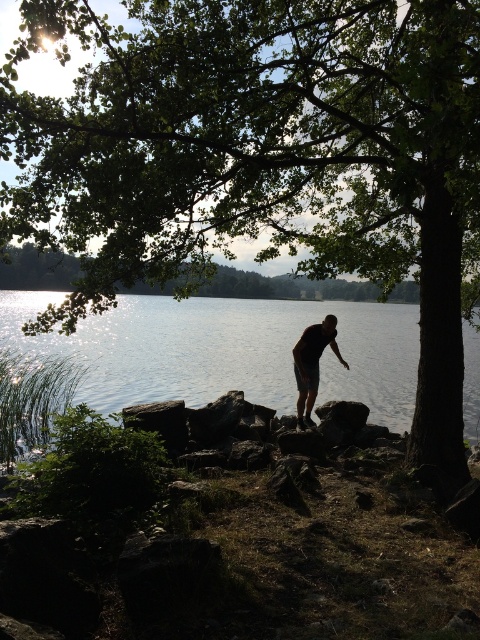
Question: Which point is closer to the camera?

Choices:
 (A) (230, 298)
 (B) (320, 330)

Answer: (B)

Question: Does glistening water at center have a smaller size compared to dark skin/shorts at center?

Choices:
 (A) no
 (B) yes

Answer: (A)

Question: Which of the following is the closest to the observer?

Choices:
 (A) dark skin/shorts at center
 (B) glistening water at center

Answer: (A)

Question: Is glistening water at center smaller than dark skin/shorts at center?

Choices:
 (A) yes
 (B) no

Answer: (B)

Question: Where is glistening water at center located in relation to dark skin/shorts at center in the image?

Choices:
 (A) above
 (B) below

Answer: (A)